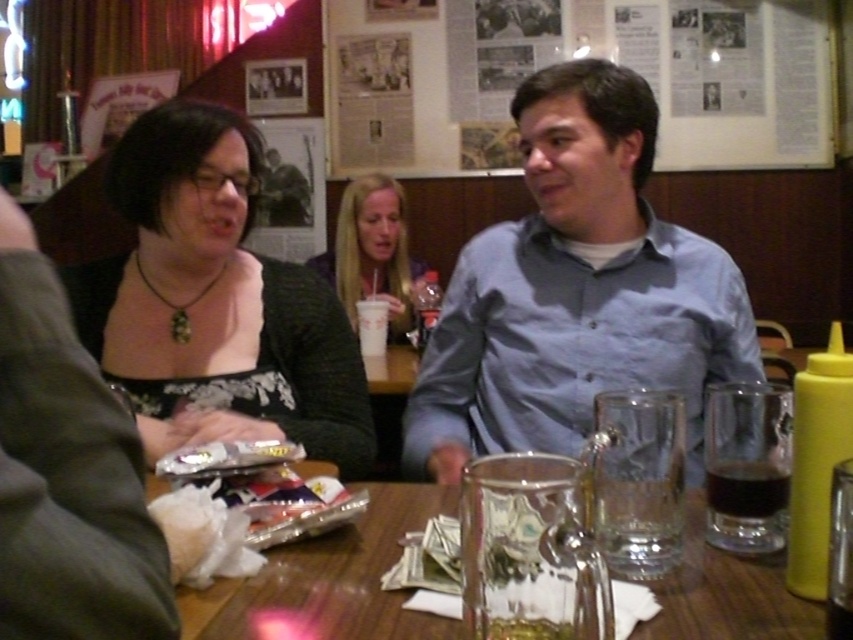
Question: Considering the relative positions of blue cotton shirt at center and dark brown liquid at lower right in the image provided, where is blue cotton shirt at center located with respect to dark brown liquid at lower right?

Choices:
 (A) below
 (B) above

Answer: (B)

Question: Which is nearer to the blue cotton shirt at center?

Choices:
 (A) dark brown liquid at lower right
 (B) shiny foil snack at center

Answer: (B)

Question: Which of the following is the farthest from the observer?

Choices:
 (A) (366, 209)
 (B) (590, 67)

Answer: (A)

Question: Does transparent glass at center appear on the left side of dark brown liquid at lower right?

Choices:
 (A) yes
 (B) no

Answer: (A)

Question: Is shiny foil snack at center closer to camera compared to dark brown liquid at lower right?

Choices:
 (A) no
 (B) yes

Answer: (B)

Question: Which point is farther to the camera?

Choices:
 (A) (759, 516)
 (B) (166, 497)
 (C) (746, 346)

Answer: (C)